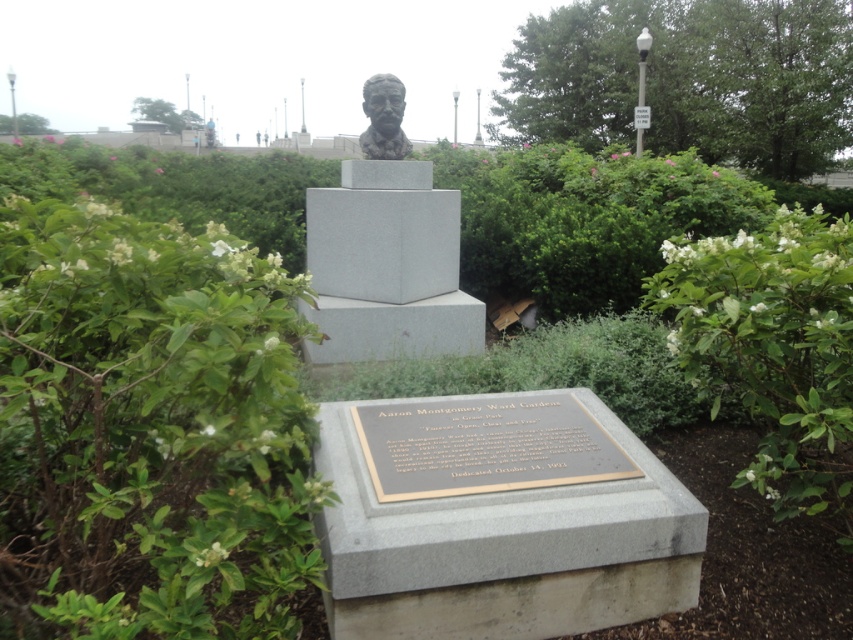
Question: Estimate the real-world distances between objects in this image. Which object is closer to the green leafy bush at upper right?

Choices:
 (A) bronze statue at center
 (B) green leafy bush at center
 (C) white leafy bush at center
 (D) bronze bust at center

Answer: (D)

Question: From the image, what is the correct spatial relationship of green leafy bush at center in relation to bronze statue at center?

Choices:
 (A) above
 (B) below

Answer: (B)

Question: Is green leafy bush at center thinner than green leafy bush at upper right?

Choices:
 (A) no
 (B) yes

Answer: (A)

Question: Which of the following is the closest to the observer?

Choices:
 (A) green leafy bush at upper right
 (B) bronze statue at center

Answer: (B)

Question: Can you confirm if bronze statue at center is wider than bronze bust at center?

Choices:
 (A) yes
 (B) no

Answer: (A)

Question: Considering the real-world distances, which object is closest to the green leafy bush at center?

Choices:
 (A) bronze statue at center
 (B) bronze bust at center
 (C) green leafy bush at upper right

Answer: (A)